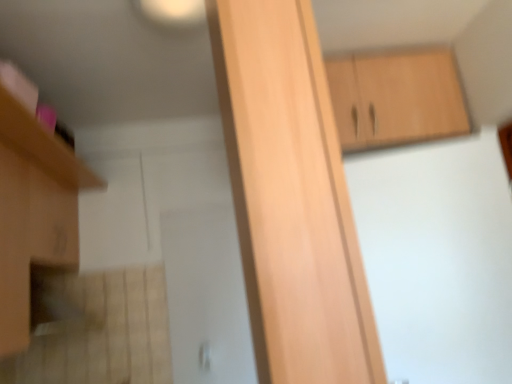
Question: Which direction should I rotate to look at light wood cabinet at center, which is the 2th cabinetry in left-to-right order, — up or down?

Choices:
 (A) down
 (B) up

Answer: (B)

Question: Is the depth of light wood cabinet at center, arranged as the 2th cabinetry when viewed from the right, less than that of matte wood cabinet at left, acting as the 3th cabinetry starting from the right?

Choices:
 (A) no
 (B) yes

Answer: (B)

Question: Is light wood cabinet at center, arranged as the 1th cabinetry when viewed from the front, turned away from matte wood cabinet at left, placed as the first cabinetry when sorted from left to right?

Choices:
 (A) yes
 (B) no

Answer: (B)

Question: Are light wood cabinet at center, arranged as the 2th cabinetry when viewed from the right, and matte wood cabinet at left, marked as the second cabinetry in a front-to-back arrangement, located far from each other?

Choices:
 (A) no
 (B) yes

Answer: (B)

Question: From a real-world perspective, is light wood cabinet at center, arranged as the 2th cabinetry when viewed from the right, physically above matte wood cabinet at left, placed as the first cabinetry when sorted from left to right?

Choices:
 (A) no
 (B) yes

Answer: (A)

Question: Is light wood cabinet at center, which is the 2th cabinetry in left-to-right order, touching matte wood cabinet at left, acting as the 3th cabinetry starting from the right?

Choices:
 (A) no
 (B) yes

Answer: (A)

Question: Considering the relative sizes of light wood cabinet at center, arranged as the 1th cabinetry when viewed from the front, and matte wood cabinet at left, acting as the 3th cabinetry starting from the right, in the image provided, is light wood cabinet at center, arranged as the 1th cabinetry when viewed from the front, thinner than matte wood cabinet at left, acting as the 3th cabinetry starting from the right,?

Choices:
 (A) no
 (B) yes

Answer: (B)

Question: Is light brown wood cabinet at upper right, placed as the first cabinetry when sorted from back to front, positioned far away from matte wood cabinet at left, marked as the second cabinetry in a back-to-front arrangement?

Choices:
 (A) yes
 (B) no

Answer: (A)

Question: Is light brown wood cabinet at upper right, placed as the first cabinetry when sorted from back to front, behind matte wood cabinet at left, marked as the second cabinetry in a front-to-back arrangement?

Choices:
 (A) no
 (B) yes

Answer: (B)

Question: From a real-world perspective, is light brown wood cabinet at upper right, the 3th cabinetry viewed from the front, below matte wood cabinet at left, placed as the first cabinetry when sorted from left to right?

Choices:
 (A) yes
 (B) no

Answer: (B)

Question: Is the surface of light brown wood cabinet at upper right, placed as the first cabinetry when sorted from back to front, in direct contact with matte wood cabinet at left, marked as the second cabinetry in a back-to-front arrangement?

Choices:
 (A) yes
 (B) no

Answer: (B)

Question: Is matte wood cabinet at left, marked as the second cabinetry in a front-to-back arrangement, a part of light brown wood cabinet at upper right, the 3th cabinetry viewed from the front?

Choices:
 (A) no
 (B) yes

Answer: (A)

Question: Could you tell me if light brown wood cabinet at upper right, the 3th cabinetry viewed from the front, is turned towards matte wood cabinet at left, marked as the second cabinetry in a front-to-back arrangement?

Choices:
 (A) yes
 (B) no

Answer: (B)

Question: Is matte wood cabinet at left, placed as the first cabinetry when sorted from left to right, far from light wood cabinet at center, which is the 2th cabinetry in left-to-right order?

Choices:
 (A) no
 (B) yes

Answer: (B)